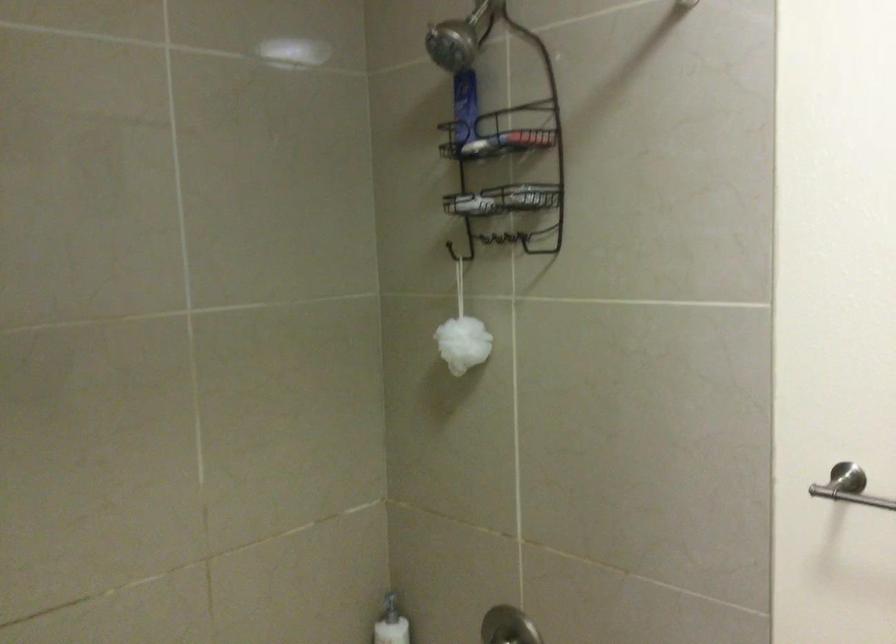
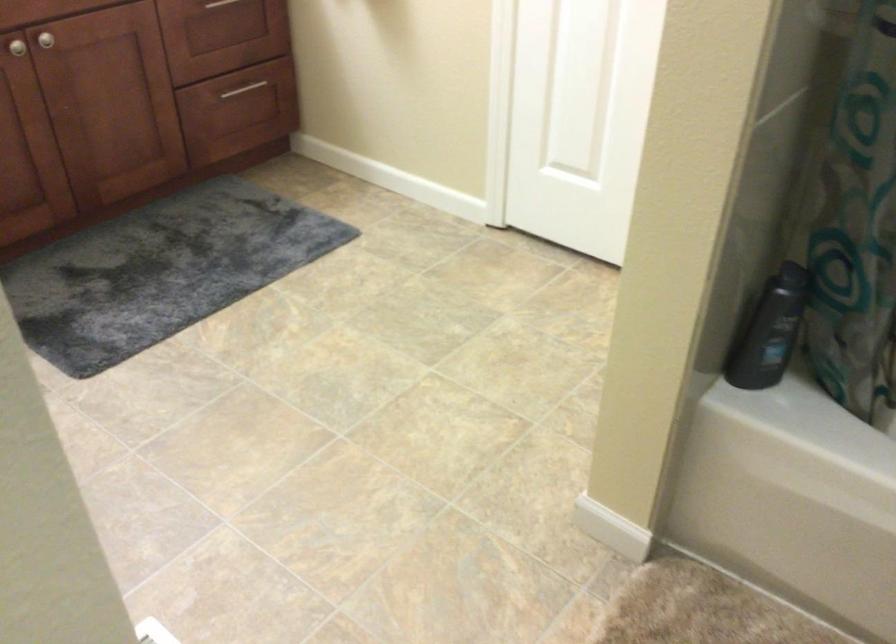
The images are taken continuously from a first-person perspective. In which direction is your viewpoint rotating?

The camera rotated toward left-down.